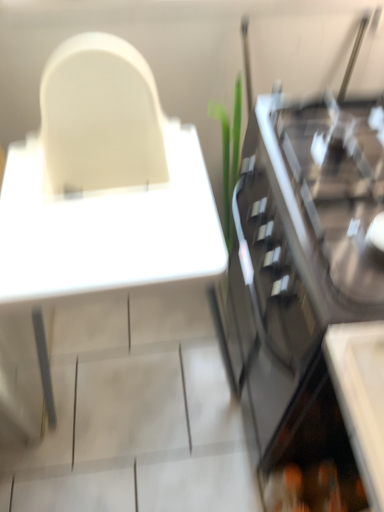
The height and width of the screenshot is (512, 384). I want to click on white plastic table at upper left, so click(x=107, y=230).

Describe the element at coordinates (107, 230) in the screenshot. I see `white plastic table at upper left` at that location.

Looking at this image, what is the approximate height of white plastic table at upper left?

white plastic table at upper left is 88.01 centimeters tall.

The height and width of the screenshot is (512, 384). Describe the element at coordinates (302, 267) in the screenshot. I see `black glass cabinet at right` at that location.

Locate an element on the screen. The width and height of the screenshot is (384, 512). black glass cabinet at right is located at coordinates (302, 267).

This screenshot has width=384, height=512. What are the coordinates of `white plastic table at upper left` in the screenshot? It's located at (107, 230).

Is white plastic table at upper left to the left of black glass cabinet at right from the viewer's perspective?

Yes, white plastic table at upper left is to the left of black glass cabinet at right.

Relative to black glass cabinet at right, is white plastic table at upper left in front or behind?

Visually, white plastic table at upper left is located in front of black glass cabinet at right.

Is point (153, 186) farther from camera compared to point (297, 230)?

Yes, point (153, 186) is farther from viewer.

From the image's perspective, is white plastic table at upper left beneath black glass cabinet at right?

Incorrect, from the image's perspective, white plastic table at upper left is higher than black glass cabinet at right.

From a real-world perspective, is white plastic table at upper left physically below black glass cabinet at right?

No, from a real-world perspective, white plastic table at upper left is not under black glass cabinet at right.

Which of these two, white plastic table at upper left or black glass cabinet at right, is thinner?

Thinner between the two is black glass cabinet at right.

From the picture: Which of these two, white plastic table at upper left or black glass cabinet at right, stands taller?

white plastic table at upper left is taller.

Who is bigger, white plastic table at upper left or black glass cabinet at right?

With larger size is white plastic table at upper left.

Do you think white plastic table at upper left is within black glass cabinet at right, or outside of it?

white plastic table at upper left is not inside black glass cabinet at right, it's outside.

Is white plastic table at upper left beside black glass cabinet at right?

No.

Is white plastic table at upper left facing towards black glass cabinet at right?

No.

The width and height of the screenshot is (384, 512). There is a black glass cabinet at right. In order to click on table above it (from a real-world perspective) in this screenshot , I will do `click(107, 230)`.

Which is more to the right, black glass cabinet at right or white plastic table at upper left?

black glass cabinet at right.

Relative to white plastic table at upper left, is black glass cabinet at right in front or behind?

Clearly, black glass cabinet at right is behind white plastic table at upper left.

Which is nearer, (255, 281) or (3, 258)?

Point (255, 281) is positioned farther from the camera compared to point (3, 258).

From the image's perspective, would you say black glass cabinet at right is positioned over white plastic table at upper left?

No, from the image's perspective, black glass cabinet at right is not above white plastic table at upper left.

From a real-world perspective, who is located higher, black glass cabinet at right or white plastic table at upper left?

white plastic table at upper left is physically above.

Which of these two, black glass cabinet at right or white plastic table at upper left, is thinner?

Thinner between the two is black glass cabinet at right.

Which of these two, black glass cabinet at right or white plastic table at upper left, stands shorter?

Standing shorter between the two is black glass cabinet at right.

Considering the sizes of objects black glass cabinet at right and white plastic table at upper left in the image provided, who is bigger, black glass cabinet at right or white plastic table at upper left?

Result: white plastic table at upper left.

Is black glass cabinet at right positioned beyond the bounds of white plastic table at upper left?

black glass cabinet at right lies outside white plastic table at upper left's area.

Would you consider black glass cabinet at right to be distant from white plastic table at upper left?

Actually, black glass cabinet at right and white plastic table at upper left are a little close together.

Is white plastic table at upper left at the back of black glass cabinet at right?

No, black glass cabinet at right's orientation is not away from white plastic table at upper left.

How distant is black glass cabinet at right from white plastic table at upper left?

10.95 inches.

Image resolution: width=384 pixels, height=512 pixels. Find the location of `cabinetry on the right of white plastic table at upper left`. cabinetry on the right of white plastic table at upper left is located at coordinates (302, 267).

You are a GUI agent. You are given a task and a screenshot of the screen. Output one action in this format:
    pyautogui.click(x=<x>, y=<y>)
    Task: Click on the table above the black glass cabinet at right (from a real-world perspective)
    The image size is (384, 512).
    Given the screenshot: What is the action you would take?
    pyautogui.click(x=107, y=230)

Locate an element on the screen. This screenshot has height=512, width=384. table on the left side of black glass cabinet at right is located at coordinates (107, 230).